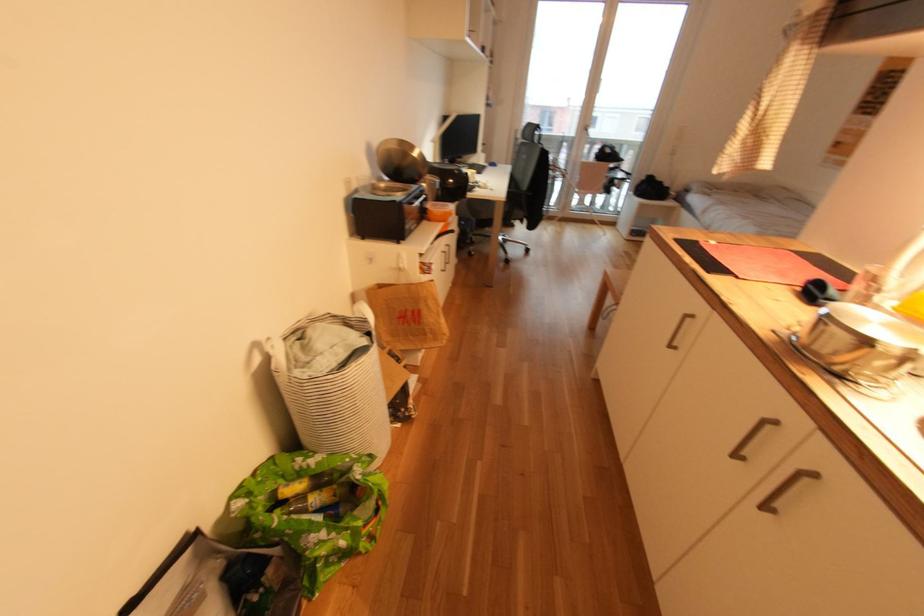
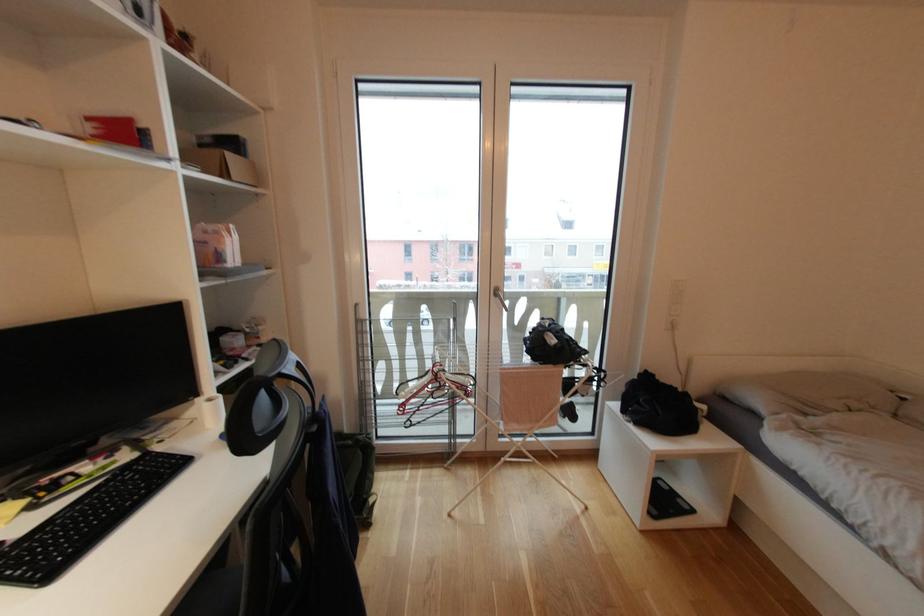
The images are taken continuously from a first-person perspective. In which direction are you moving?

The cameraman walked toward right, forward.